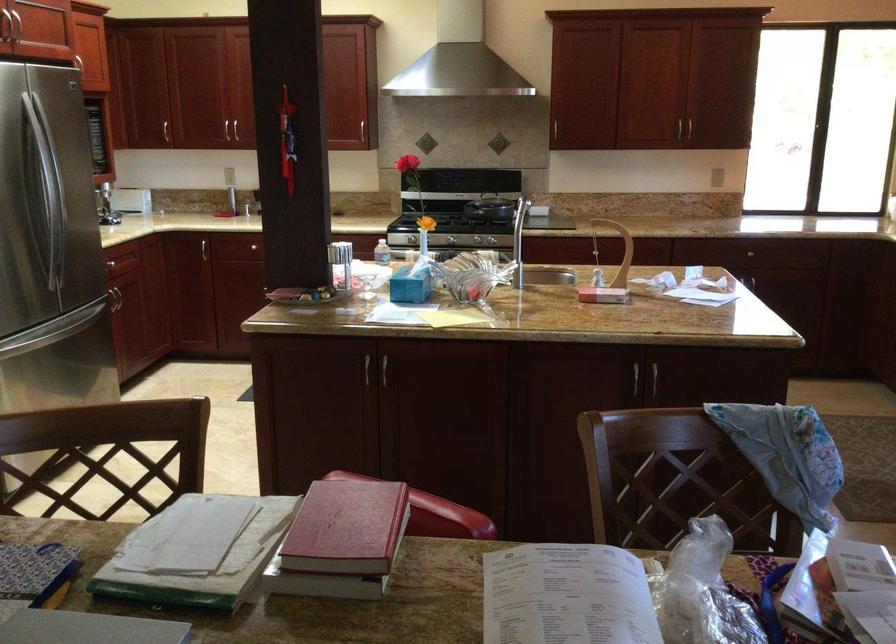
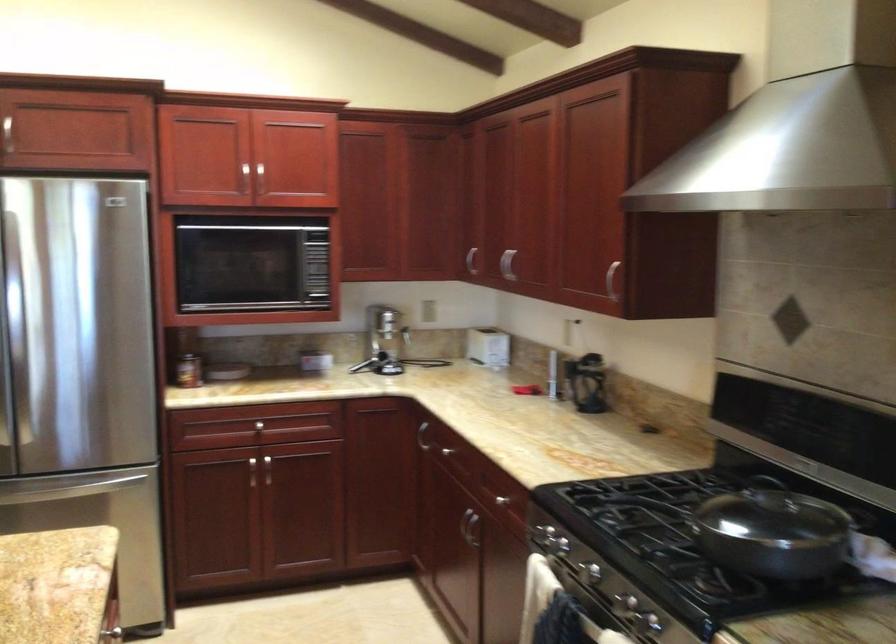
Where in the second image is the point corresponding to [110,124] from the first image?

(471, 261)